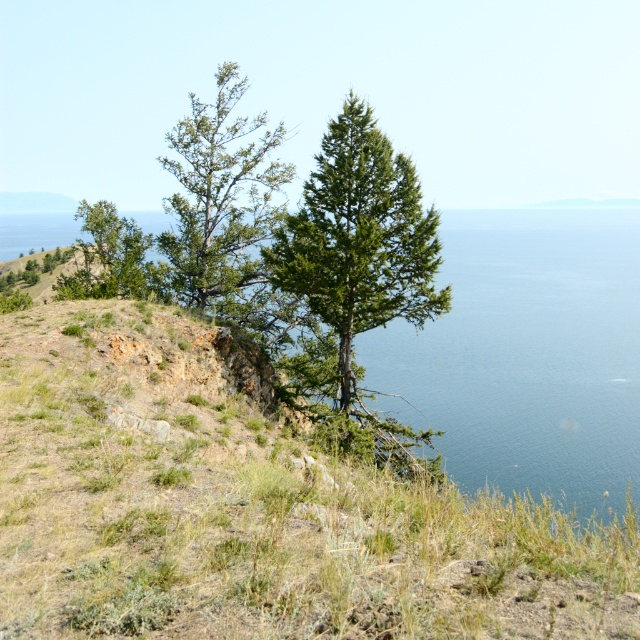
You are standing on the hillside and want to take a photo of both the green textured tree at center and the green textured tree at upper left. Which tree should you position closer to the camera to ensure both are in focus?

To ensure both the green textured tree at center and the green textured tree at upper left are in focus, you should position the green textured tree at center closer to the camera since it is in front of the green textured tree at upper left. This way, the camera can capture both trees within the depth of field by focusing on the closer tree.

You are a hiker standing on the hillside and want to take a photo of both the green textured tree at center and the green matte tree at upper left. Which tree should you position closer to the edge of your camera frame to include both in the shot?

You should position the green matte tree at upper left closer to the edge of your camera frame because the green textured tree at center is positioned to its right, so moving the matte tree towards the edge allows both trees to fit within the frame.